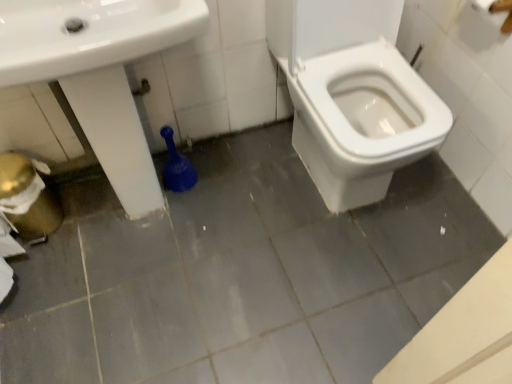
You are a GUI agent. You are given a task and a screenshot of the screen. Output one action in this format:
    pyautogui.click(x=<x>, y=<y>)
    Task: Click on the free area below white glossy sink at lower left (from a real-world perspective)
    Image resolution: width=512 pixels, height=384 pixels.
    Given the screenshot: What is the action you would take?
    pyautogui.click(x=132, y=211)